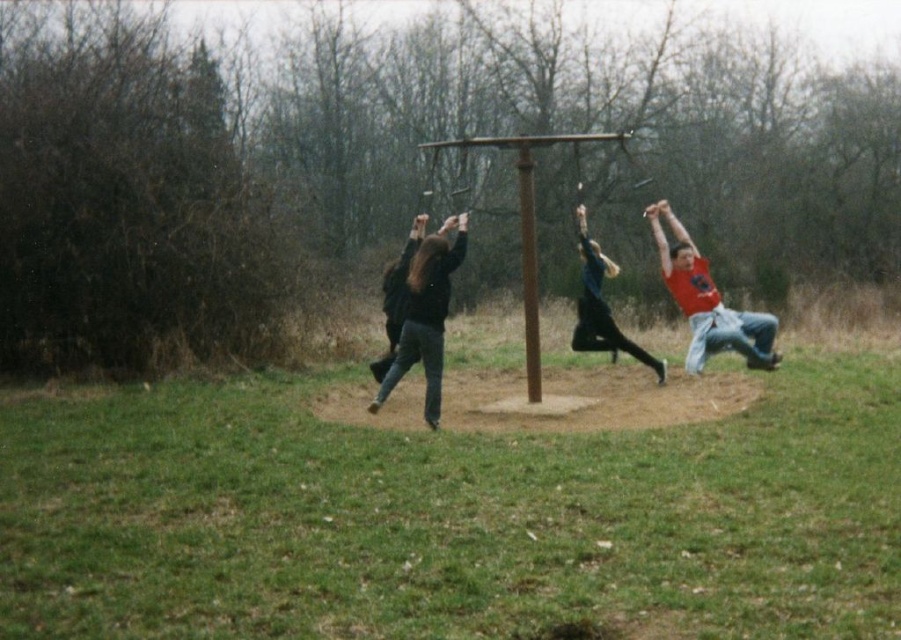
You are a photographer trying to capture a closeup of the brown wooden pole at center without the black fabric pants at center blocking the view. Based on their sizes, can you determine if the pole will be fully visible in the photo?

The black fabric pants at center is larger in size than brown wooden pole at center, so the pole may be partially obscured by the pants in the photo.

From the picture: You are a photographer trying to capture a closeup of the brown wooden pole at center without including the black matte jacket at center in the frame. Given their positions, is this possible?

The black matte jacket at center is wider than the brown wooden pole at center, so it might block the view. You need to adjust your angle or move closer to avoid the jacket.